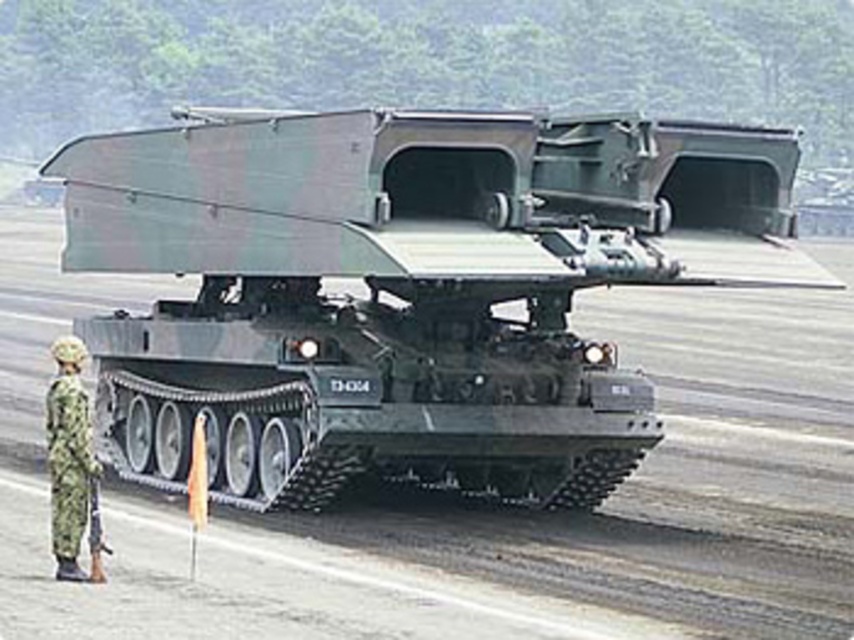
Does point (174, 403) come in front of point (80, 403)?

No, it is behind (80, 403).

Is camouflage matte tank at center to the left of camouflage fabric uniform at lower left from the viewer's perspective?

Incorrect, camouflage matte tank at center is not on the left side of camouflage fabric uniform at lower left.

Image resolution: width=854 pixels, height=640 pixels. What do you see at coordinates (404, 289) in the screenshot? I see `camouflage matte tank at center` at bounding box center [404, 289].

Identify the location of camouflage matte tank at center. (404, 289).